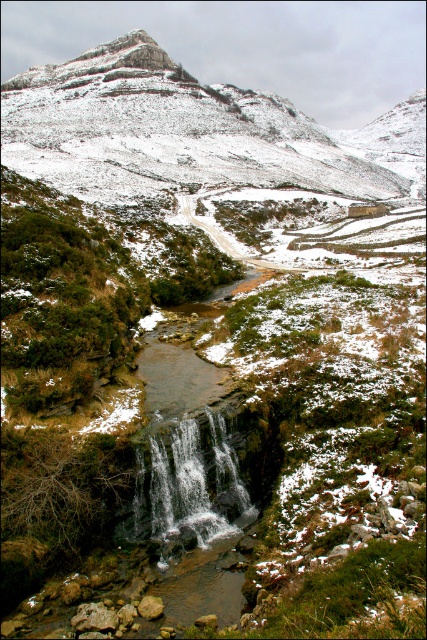
You are planning a hiking trip and need to know the relative sizes of the snowy rocky mountain at center and the white frothy water at center in the image. Which one is bigger?

The snowy rocky mountain at center is larger in size than the white frothy water at center.

You are standing at point (224, 497) and want to walk to the snow covered mountain in the distance. Is the point (181, 164) located between you and the mountain?

Point (181, 164) is behind point (224, 497), so it is not between you and the mountain. You would not encounter point (181, 164) on your path to the mountain.

Based on the scene description, what is the 2D coordinate of the snowy rocky mountain at center?

The snowy rocky mountain at center is located at the 2D coordinate point of (190, 132).